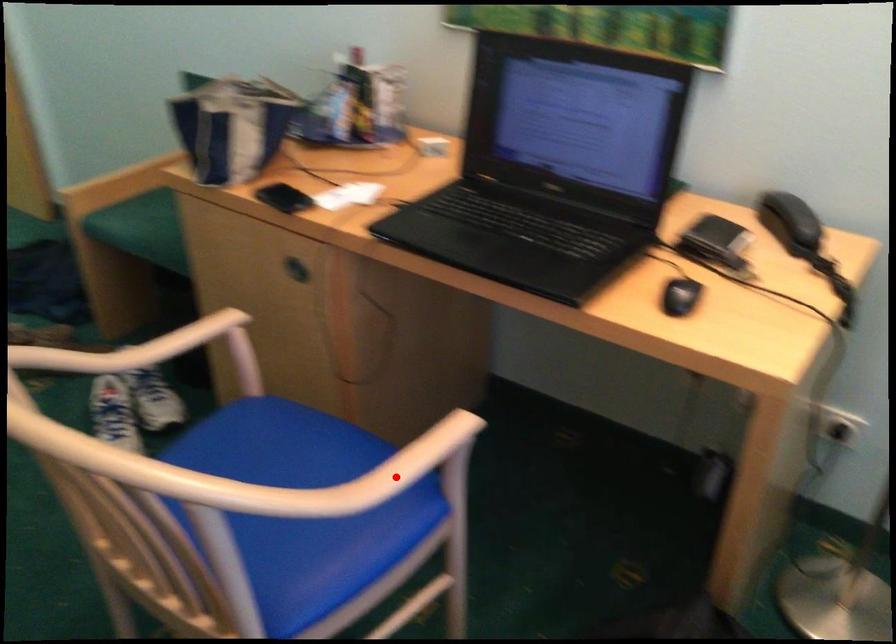
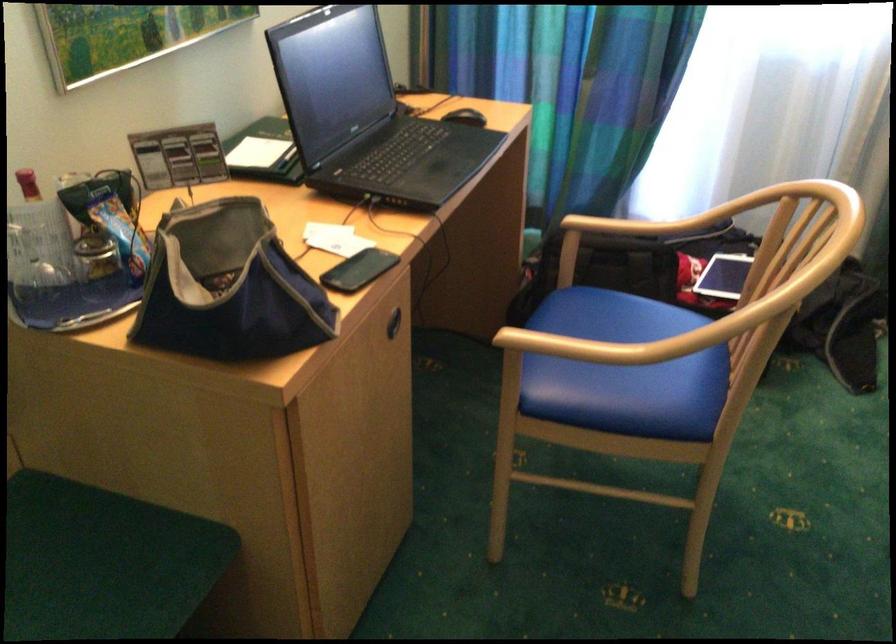
Question: I am providing you with two images of the same scene from different viewpoints. In image1, a red point is highlighted. Considering the same 3D point in image2, which of the following is correct?

Choices:
 (A) It is closer
 (B) It is farther

Answer: (B)